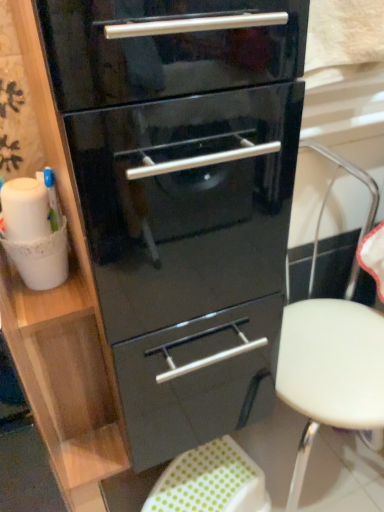
The width and height of the screenshot is (384, 512). Identify the location of glossy black chest of drawers at center. (182, 202).

At what (x,y) coordinates should I click in order to perform the action: click on green polka dot fabric step stool at lower center. Please return your answer as a coordinate pair (x, y). This screenshot has height=512, width=384. Looking at the image, I should click on (210, 482).

Between white plastic stool at center and green polka dot fabric step stool at lower center, which one has smaller width?

With smaller width is green polka dot fabric step stool at lower center.

Is white plastic stool at center smaller than green polka dot fabric step stool at lower center?

Actually, white plastic stool at center might be larger than green polka dot fabric step stool at lower center.

Is there a large distance between white plastic stool at center and green polka dot fabric step stool at lower center?

No.

Which object is closer to the camera, white plastic stool at center or green polka dot fabric step stool at lower center?

Positioned in front is white plastic stool at center.

Which is nearer, [91,131] or [360,174]?

Point [91,131] appears to be closer to the viewer than point [360,174].

Find the location of a particular element. The width and height of the screenshot is (384, 512). folding chair to the right of glossy black chest of drawers at center is located at coordinates (331, 369).

Considering the relative sizes of glossy black chest of drawers at center and white plastic stool at center in the image provided, is glossy black chest of drawers at center smaller than white plastic stool at center?

Yes, glossy black chest of drawers at center is smaller than white plastic stool at center.

Does white plastic stool at center come behind glossy black chest of drawers at center?

Yes, the depth of white plastic stool at center is greater than that of glossy black chest of drawers at center.

How much distance is there between white plastic stool at center and glossy black chest of drawers at center?

11.54 inches.

Which object is positioned more to the left, white plastic stool at center or glossy black chest of drawers at center?

From the viewer's perspective, glossy black chest of drawers at center appears more on the left side.

From a real-world perspective, relative to glossy black chest of drawers at center, is white plastic stool at center vertically above or below?

Clearly, from a real-world perspective, white plastic stool at center is below glossy black chest of drawers at center.

In the image, is green polka dot fabric step stool at lower center positioned in front of or behind white plastic stool at center?

green polka dot fabric step stool at lower center is positioned farther from the viewer than white plastic stool at center.

Measure the distance between green polka dot fabric step stool at lower center and white plastic stool at center.

green polka dot fabric step stool at lower center is 12.59 inches away from white plastic stool at center.

Can you confirm if green polka dot fabric step stool at lower center is taller than white plastic stool at center?

No, green polka dot fabric step stool at lower center is not taller than white plastic stool at center.

From a real-world perspective, is green polka dot fabric step stool at lower center physically located above or below white plastic stool at center?

Clearly, from a real-world perspective, green polka dot fabric step stool at lower center is below white plastic stool at center.

Can you confirm if glossy black chest of drawers at center is taller than green polka dot fabric step stool at lower center?

Yes, glossy black chest of drawers at center is taller than green polka dot fabric step stool at lower center.

Would you say glossy black chest of drawers at center is inside or outside green polka dot fabric step stool at lower center?

glossy black chest of drawers at center is spatially situated outside green polka dot fabric step stool at lower center.

From a real-world perspective, who is located lower, glossy black chest of drawers at center or green polka dot fabric step stool at lower center?

green polka dot fabric step stool at lower center, from a real-world perspective.

Is the surface of glossy black chest of drawers at center in direct contact with green polka dot fabric step stool at lower center?

They are not placed beside each other.

Is green polka dot fabric step stool at lower center positioned before glossy black chest of drawers at center?

No, the depth of green polka dot fabric step stool at lower center is greater than that of glossy black chest of drawers at center.

This screenshot has height=512, width=384. What are the coordinates of `step stool below the glossy black chest of drawers at center (from a real-world perspective)` in the screenshot? It's located at (210, 482).

Is green polka dot fabric step stool at lower center aimed at glossy black chest of drawers at center?

No.

Can you confirm if green polka dot fabric step stool at lower center is positioned to the left of glossy black chest of drawers at center?

In fact, green polka dot fabric step stool at lower center is to the right of glossy black chest of drawers at center.

Find the location of a particular element. The image size is (384, 512). step stool that appears below the white plastic stool at center (from a real-world perspective) is located at coordinates (210, 482).

In order to click on folding chair behind the glossy black chest of drawers at center in this screenshot , I will do `click(331, 369)`.

When comparing their distances from green polka dot fabric step stool at lower center, does glossy black chest of drawers at center or white plastic stool at center seem further?

glossy black chest of drawers at center is positioned further to the anchor green polka dot fabric step stool at lower center.

Estimate the real-world distances between objects in this image. Which object is further from white plastic stool at center, green polka dot fabric step stool at lower center or glossy black chest of drawers at center?

green polka dot fabric step stool at lower center.

From the image, which object appears to be nearer to green polka dot fabric step stool at lower center, white plastic stool at center or glossy black chest of drawers at center?

white plastic stool at center lies closer to green polka dot fabric step stool at lower center than the other object.

From the image, which object appears to be farther from glossy black chest of drawers at center, green polka dot fabric step stool at lower center or white plastic stool at center?

Among the two, green polka dot fabric step stool at lower center is located further to glossy black chest of drawers at center.

Based on the photo, looking at the image, which one is located further to glossy black chest of drawers at center, white plastic stool at center or green polka dot fabric step stool at lower center?

green polka dot fabric step stool at lower center lies further to glossy black chest of drawers at center than the other object.

Which object lies nearer to the anchor point white plastic stool at center, glossy black chest of drawers at center or green polka dot fabric step stool at lower center?

The object closer to white plastic stool at center is glossy black chest of drawers at center.

Locate an element on the screen. The height and width of the screenshot is (512, 384). folding chair between glossy black chest of drawers at center and green polka dot fabric step stool at lower center in the vertical direction is located at coordinates (331, 369).